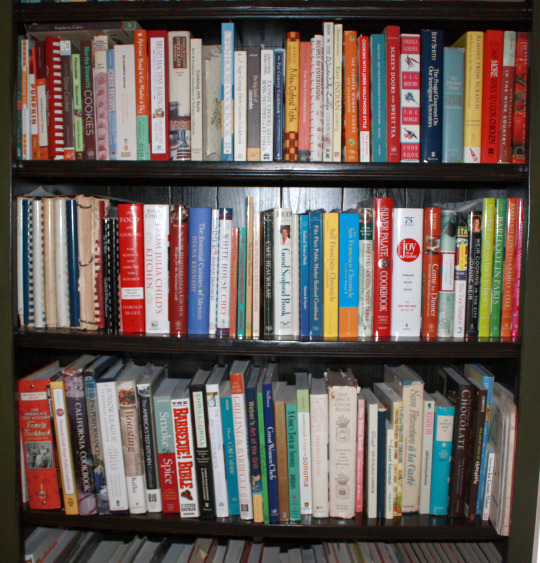
At what (x,y) coordinates should I click in order to perform the action: click on books with red covers. Please return your answer as a coordinate pair (x, y). Looking at the image, I should click on (523, 65), (495, 96), (394, 92), (49, 60), (127, 239), (173, 259), (384, 278), (432, 279), (40, 484), (362, 70).